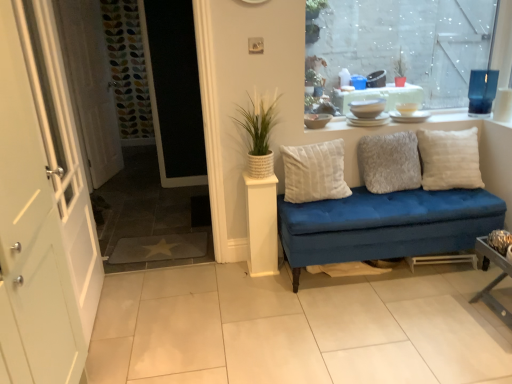
Locate an element on the screen. The image size is (512, 384). vacant space positioned to the left of white matte pedestal at center, marked as the first table in a left-to-right arrangement is located at coordinates (233, 268).